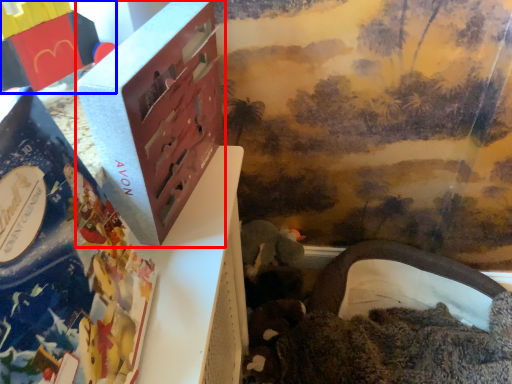
Question: Which point is further to the camera, box (highlighted by a red box) or toy (highlighted by a blue box)?

Choices:
 (A) box
 (B) toy

Answer: (B)